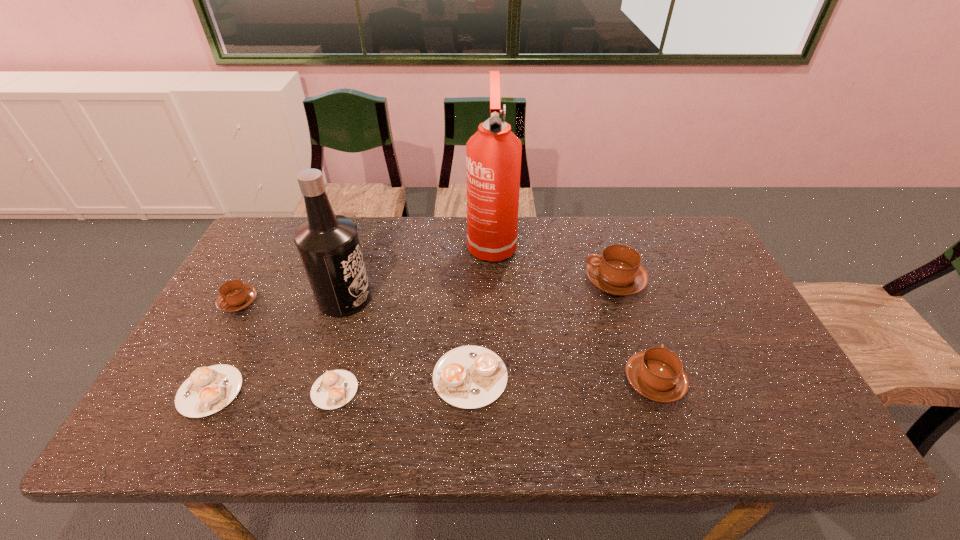
Locate which white cappuccino is the second closest to the black liquor. Please provide its 2D coordinates. Your answer should be formatted as a tuple, i.e. [(x, y)], where the tuple contains the x and y coordinates of a point satisfying the conditions above.

[(209, 389)]

Identify which white cappuccino is the second nearest to the smallest brown cappuccino. Please provide its 2D coordinates. Your answer should be formatted as a tuple, i.e. [(x, y)], where the tuple contains the x and y coordinates of a point satisfying the conditions above.

[(333, 389)]

Where is `free space that satisfies the following two spatial constraints: 1. on the side of the sixth shortest object with the handle; 2. on the front side of the second smallest white cappuccino`? free space that satisfies the following two spatial constraints: 1. on the side of the sixth shortest object with the handle; 2. on the front side of the second smallest white cappuccino is located at coordinates (651, 391).

Find the location of a particular element. The image size is (960, 540). vacant space that satisfies the following two spatial constraints: 1. on the front label of the second tallest object; 2. on the side of the third tallest cappuccino with the handle is located at coordinates (344, 302).